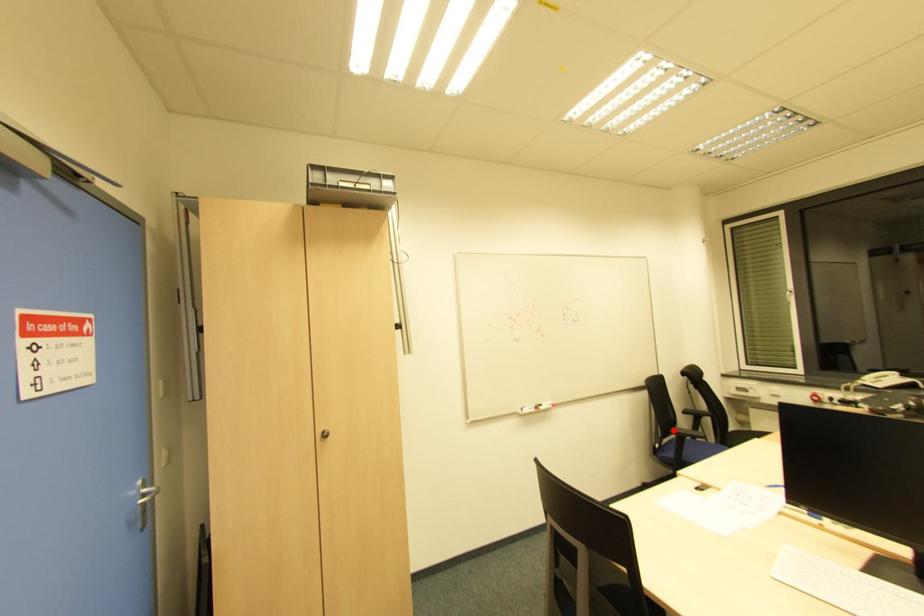
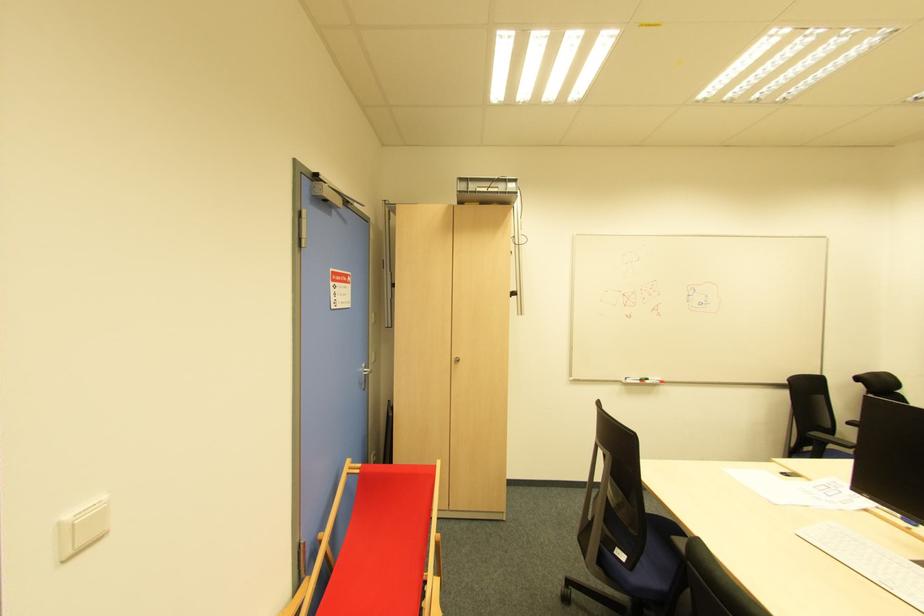
Question: I am providing you with two images of the same scene from different viewpoints. Image1 has a red point marked. In image2, the corresponding 3D location appears at what relative position? Reply with the corresponding letter.

Choices:
 (A) Closer
 (B) Farther

Answer: (B)